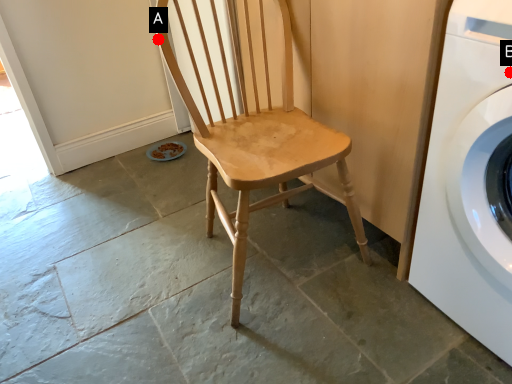
Question: Two points are circled on the image, labeled by A and B beside each circle. Which point appears closest to the camera in this image?

Choices:
 (A) A is closer
 (B) B is closer

Answer: (B)